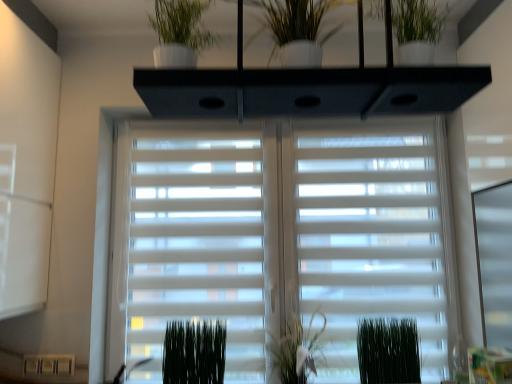
Question: Does green matte plant at lower right, the third plant positioned from the left, have a larger size compared to white glossy vase at upper center?

Choices:
 (A) no
 (B) yes

Answer: (A)

Question: Could you tell me if green matte plant at lower right, the first plant in the right-to-left sequence, is facing white glossy vase at upper center?

Choices:
 (A) yes
 (B) no

Answer: (B)

Question: Would you say green matte plant at lower right, the third plant positioned from the left, is outside white glossy vase at upper center?

Choices:
 (A) no
 (B) yes

Answer: (B)

Question: From a real-world perspective, is green matte plant at lower right, the third plant positioned from the left, located higher than white glossy vase at upper center?

Choices:
 (A) yes
 (B) no

Answer: (B)

Question: Is green matte plant at lower right, the third plant positioned from the left, touching white glossy vase at upper center?

Choices:
 (A) no
 (B) yes

Answer: (A)

Question: Considering the positions of white glossy vase at upper center and green matte plant at lower center, which is counted as the 3th plant, starting from the right, in the image, is white glossy vase at upper center bigger or smaller than green matte plant at lower center, which is counted as the 3th plant, starting from the right,?

Choices:
 (A) big
 (B) small

Answer: (A)

Question: Would you say white glossy vase at upper center is to the left or to the right of green matte plant at lower center, which is counted as the 1th plant, starting from the left, in the picture?

Choices:
 (A) right
 (B) left

Answer: (A)

Question: Is point (275, 34) positioned closer to the camera than point (219, 375)?

Choices:
 (A) farther
 (B) closer

Answer: (B)

Question: From the image's perspective, relative to green matte plant at lower center, which is counted as the 1th plant, starting from the left, is white glossy vase at upper center above or below?

Choices:
 (A) above
 (B) below

Answer: (A)

Question: From the image's perspective, relative to white matte window blind at center, is green matte plant at lower right, the third plant positioned from the left, above or below?

Choices:
 (A) below
 (B) above

Answer: (A)

Question: Looking at the image, does green matte plant at lower right, the first plant in the right-to-left sequence, seem bigger or smaller compared to white matte window blind at center?

Choices:
 (A) big
 (B) small

Answer: (B)

Question: Considering the positions of point (374, 352) and point (134, 319), is point (374, 352) closer or farther from the camera than point (134, 319)?

Choices:
 (A) farther
 (B) closer

Answer: (B)

Question: From a real-world perspective, is green matte plant at lower right, the first plant in the right-to-left sequence, above or below white matte window blind at center?

Choices:
 (A) below
 (B) above

Answer: (A)

Question: In terms of size, does green matte plant at lower right, the third plant positioned from the left, appear bigger or smaller than white glossy vase at upper center?

Choices:
 (A) small
 (B) big

Answer: (A)

Question: Is point (364, 365) positioned closer to the camera than point (311, 54)?

Choices:
 (A) closer
 (B) farther

Answer: (B)